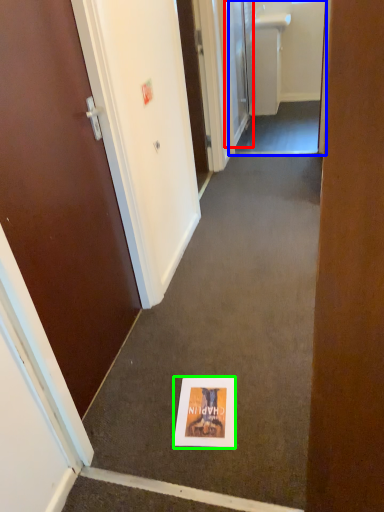
Question: Which object is the closest to the door (highlighted by a red box)? Choose among these: passage (highlighted by a blue box) or flyer (highlighted by a green box).

Choices:
 (A) passage
 (B) flyer

Answer: (A)